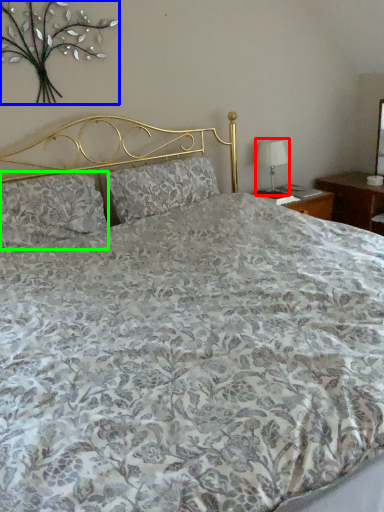
Question: Which is farther away from table lamp (highlighted by a red box)? floral arrangement (highlighted by a blue box) or pillow (highlighted by a green box)?

Choices:
 (A) floral arrangement
 (B) pillow

Answer: (B)